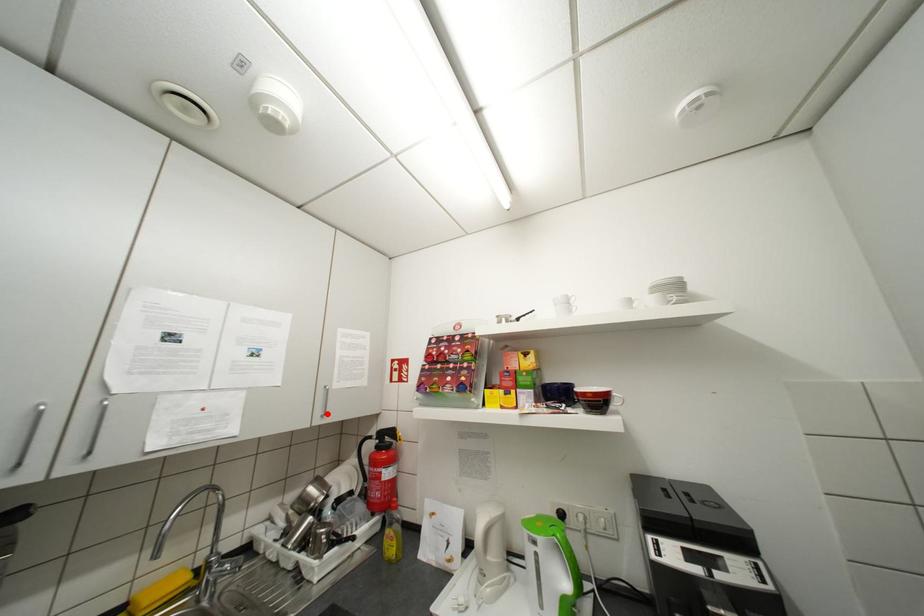
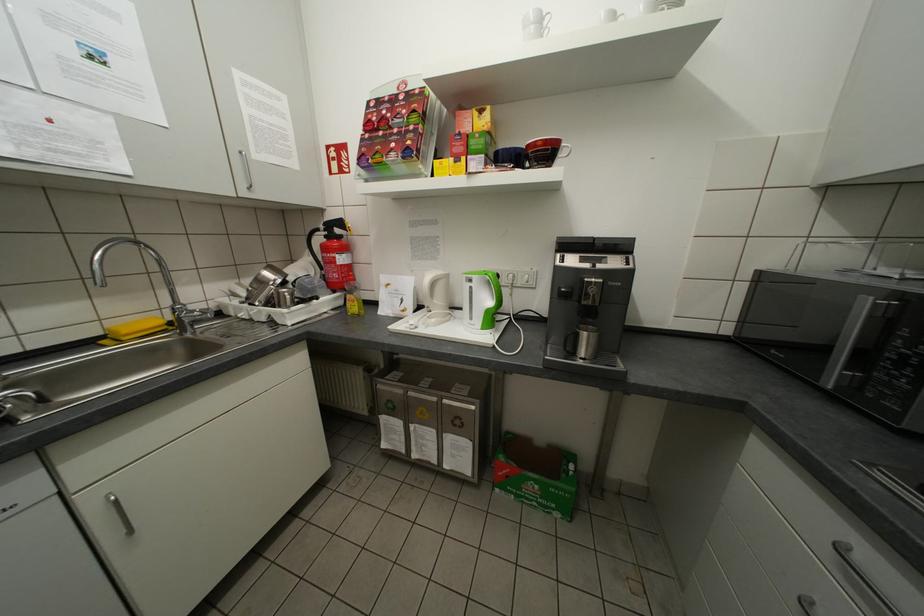
Question: I am providing you with two images of the same scene from different viewpoints. Image1 has a red point marked. In image2, the corresponding 3D location appears at what relative position? Reply with the corresponding letter.

Choices:
 (A) Closer
 (B) Farther

Answer: (A)